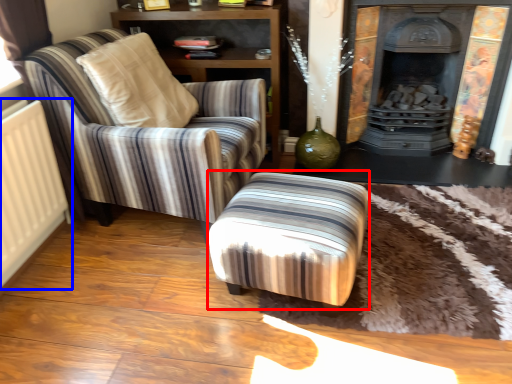
Question: Which object appears farthest to the camera in this image, stool (highlighted by a red box) or radiator (highlighted by a blue box)?

Choices:
 (A) stool
 (B) radiator

Answer: (A)